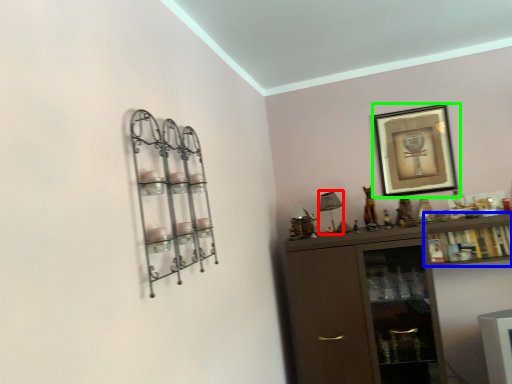
Question: Which object is the farthest from lamp (highlighted by a red box)? Choose among these: cabinet (highlighted by a blue box) or picture frame (highlighted by a green box).

Choices:
 (A) cabinet
 (B) picture frame

Answer: (A)